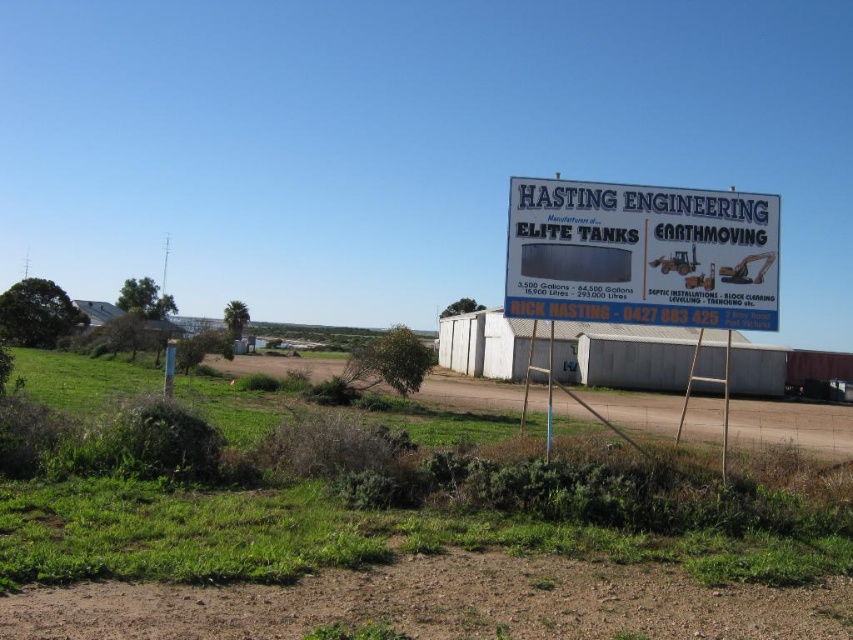
You are driving a delivery truck that is 2.5 meters wide. You need to pass through the brown dirt track at lower center and the white plastic sign at upper right. Can your truck fit through the space between them?

The brown dirt track at lower center is positioned on the left side of white plastic sign at upper right. Since the truck is 2.5 meters wide, the space between them must be at least 2.5 meters. However, the description does not provide the exact distance between them, so it is unclear if the truck can fit through the space between them.

In the scene shown: You are a delivery driver approaching the Hasting Engineering billboard. Your GPS shows a point at coordinates (442, 604). What is located at this point?

The brown dirt track at lower center is located at point (442, 604).

You are a surveyor standing at the point with coordinates point (747, 202). You need to reach the point with coordinates point (660, 588). According to the image, which direction should you move to reach the destination?

You should move forward because point (660, 588) is in front of point (747, 202).